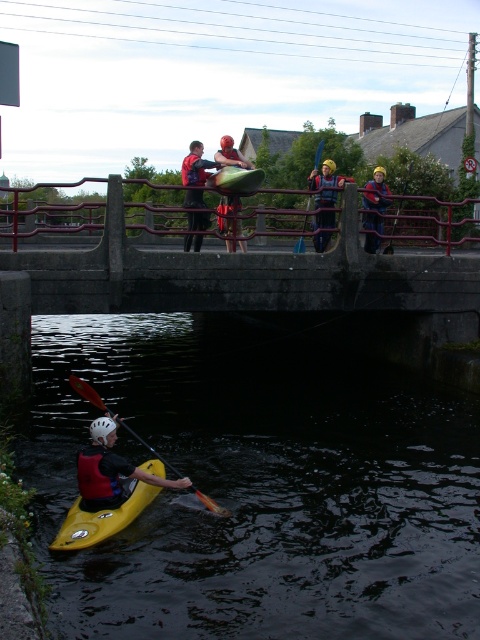
Question: Considering the real-world distances, which object is farthest from the orange life jacket at lower left?

Choices:
 (A) blue fabric life jacket at center
 (B) concrete bridge at center
 (C) matte red life jacket at upper center
 (D) red life jacket at center

Answer: (A)

Question: Does orange life jacket at lower left have a lesser width compared to yellow fabric life jacket at center?

Choices:
 (A) yes
 (B) no

Answer: (A)

Question: Is matte red kayak at lower left thinner than blue plastic paddle at upper center?

Choices:
 (A) no
 (B) yes

Answer: (B)

Question: Which point appears farthest from the camera in this image?

Choices:
 (A) (215, 509)
 (B) (228, 172)
 (C) (224, 228)
 (D) (337, 260)

Answer: (C)

Question: Which is farther from the matte green canoe at center?

Choices:
 (A) yellow fabric life jacket at upper center
 (B) matte black kayak at upper center
 (C) concrete bridge at center

Answer: (A)

Question: Is orange paddle at lower center to the right of matte green canoe at center from the viewer's perspective?

Choices:
 (A) no
 (B) yes

Answer: (A)